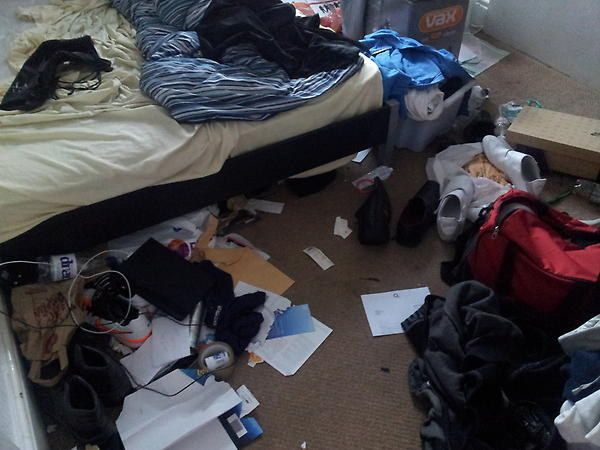
Identify the location of plastic bin. This screenshot has height=450, width=600. (427, 130).